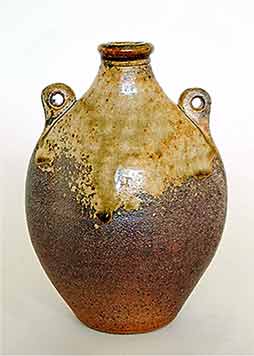
Identify the location of neck of vase. (129, 77).